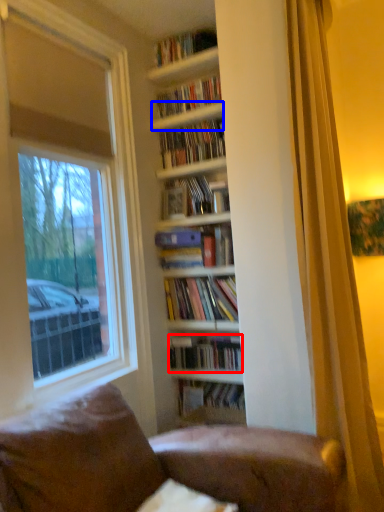
Question: Which of the following is the farthest to the observer, book (highlighted by a red box) or shelf (highlighted by a blue box)?

Choices:
 (A) book
 (B) shelf

Answer: (B)